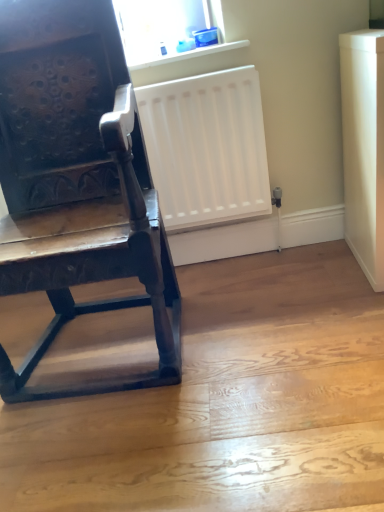
Question: Is dark wood chair at left wider than transparent plastic container at upper center?

Choices:
 (A) no
 (B) yes

Answer: (B)

Question: Does dark wood chair at left lie in front of transparent plastic container at upper center?

Choices:
 (A) yes
 (B) no

Answer: (A)

Question: Is dark wood chair at left facing away from transparent plastic container at upper center?

Choices:
 (A) no
 (B) yes

Answer: (A)

Question: Does dark wood chair at left have a larger size compared to transparent plastic container at upper center?

Choices:
 (A) yes
 (B) no

Answer: (A)

Question: From the image's perspective, is dark wood chair at left located above transparent plastic container at upper center?

Choices:
 (A) no
 (B) yes

Answer: (A)

Question: Is point (215, 45) closer or farther from the camera than point (145, 33)?

Choices:
 (A) farther
 (B) closer

Answer: (B)

Question: Is white plastic window sill at upper center wider or thinner than transparent plastic container at upper center?

Choices:
 (A) wide
 (B) thin

Answer: (A)

Question: Choose the correct answer: Is white plastic window sill at upper center inside transparent plastic container at upper center or outside it?

Choices:
 (A) outside
 (B) inside

Answer: (A)

Question: From the image's perspective, is white plastic window sill at upper center above or below transparent plastic container at upper center?

Choices:
 (A) above
 (B) below

Answer: (B)

Question: Is transparent plastic container at upper center spatially inside dark wood chair at left, or outside of it?

Choices:
 (A) outside
 (B) inside

Answer: (A)

Question: From the image's perspective, is transparent plastic container at upper center positioned above or below dark wood chair at left?

Choices:
 (A) above
 (B) below

Answer: (A)

Question: Is transparent plastic container at upper center taller or shorter than dark wood chair at left?

Choices:
 (A) tall
 (B) short

Answer: (B)

Question: Considering the positions of transparent plastic container at upper center and dark wood chair at left in the image, is transparent plastic container at upper center bigger or smaller than dark wood chair at left?

Choices:
 (A) big
 (B) small

Answer: (B)

Question: Considering the relative positions of dark wood chair at left and white plastic window sill at upper center in the image provided, is dark wood chair at left to the left or to the right of white plastic window sill at upper center?

Choices:
 (A) left
 (B) right

Answer: (A)

Question: In terms of height, does dark wood chair at left look taller or shorter compared to white plastic window sill at upper center?

Choices:
 (A) tall
 (B) short

Answer: (A)